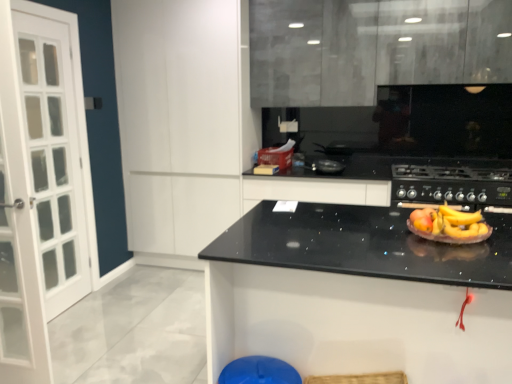
Identify the location of vacant space to the left of matte black paper plate at center. This screenshot has width=512, height=384. (375, 227).